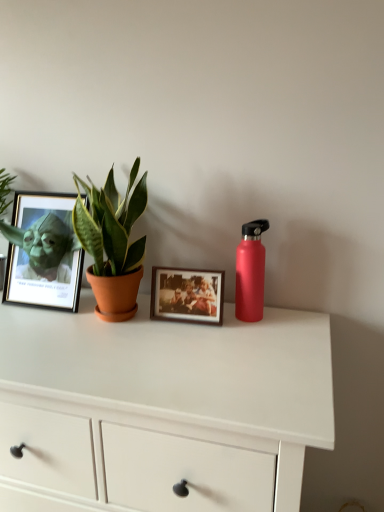
The image size is (384, 512). I want to click on vacant area on top of white matte chest of drawers at center (from a real-world perspective), so click(131, 340).